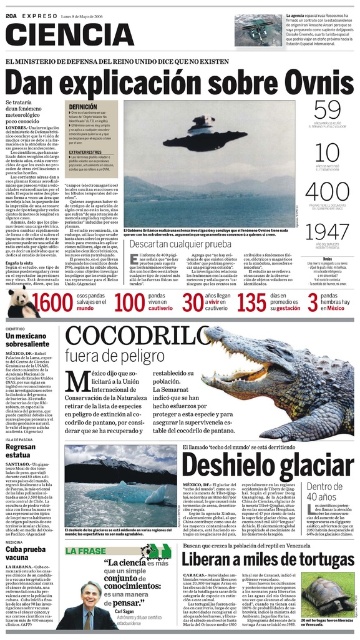
You are a photographer standing at the camera position in the newspaper image. You want to take a photo of the shiny brown crocodile at center. Given that the camera and crocodile are 78.35 feet apart, is this distance within the camera lens range of 100 feet? Explain your reasoning based on the scene description.

The shiny brown crocodile at center and camera are 78.35 feet apart. Since the camera lens range is 100 feet, the distance of 78.35 feet is within the required range. Therefore, the photographer can take the photo successfully.

You are a researcher analyzing the newspaper layout. The shiny brown crocodile at center and the matte gray crocodile at center are both present in the image. Which crocodile has a larger height?

The shiny brown crocodile at center has a greater height compared to the matte gray crocodile at center.

You are a researcher analyzing the layout of this newspaper page. You need to determine the vertical position of the shiny brown crocodile at center relative to the matte gray crocodile at center. Which one is placed higher on the page?

The shiny brown crocodile at center is located above the matte gray crocodile at center, so it is placed higher on the page.